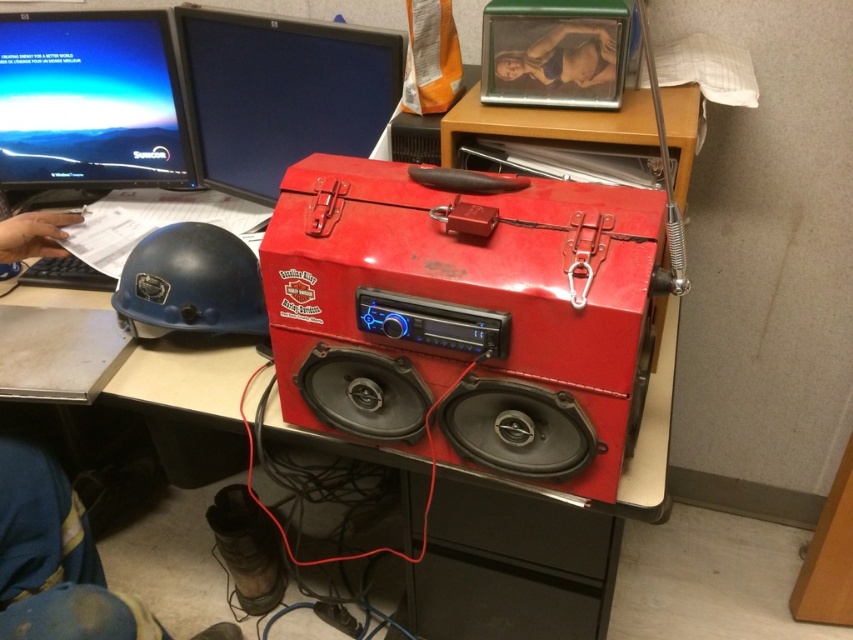
Is matte black monitor at upper left above blue hard plastic helmet at left?

Yes, matte black monitor at upper left is above blue hard plastic helmet at left.

The height and width of the screenshot is (640, 853). Describe the element at coordinates (90, 106) in the screenshot. I see `matte black monitor at upper left` at that location.

Is point (39, 202) closer to camera compared to point (206, 300)?

No.

The width and height of the screenshot is (853, 640). In order to click on matte black monitor at upper left in this screenshot , I will do `click(90, 106)`.

Describe the element at coordinates (281, 92) in the screenshot. This screenshot has width=853, height=640. I see `matte black monitor at upper center` at that location.

Is matte black monitor at upper center above blue hard plastic helmet at left?

Yes.

Is point (207, 45) positioned after point (123, 288)?

Yes, point (207, 45) is behind point (123, 288).

At what (x,y) coordinates should I click in order to perform the action: click on matte black monitor at upper center. Please return your answer as a coordinate pair (x, y). Looking at the image, I should click on (281, 92).

Can you confirm if glossy plastic speaker at center is taller than matte black monitor at upper left?

Indeed, glossy plastic speaker at center has a greater height compared to matte black monitor at upper left.

Is point (316, 228) positioned behind point (84, 125)?

No, it is not.

Who is more forward, [595,451] or [154,90]?

Positioned in front is point [595,451].

This screenshot has height=640, width=853. What are the coordinates of `glossy plastic speaker at center` in the screenshot? It's located at (463, 317).